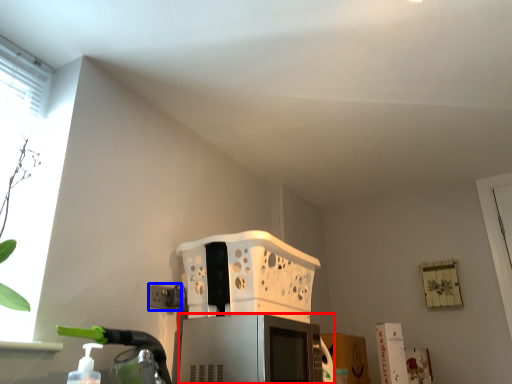
Question: Which point is further to the camera, appliance (highlighted by a red box) or electric outlet (highlighted by a blue box)?

Choices:
 (A) appliance
 (B) electric outlet

Answer: (B)